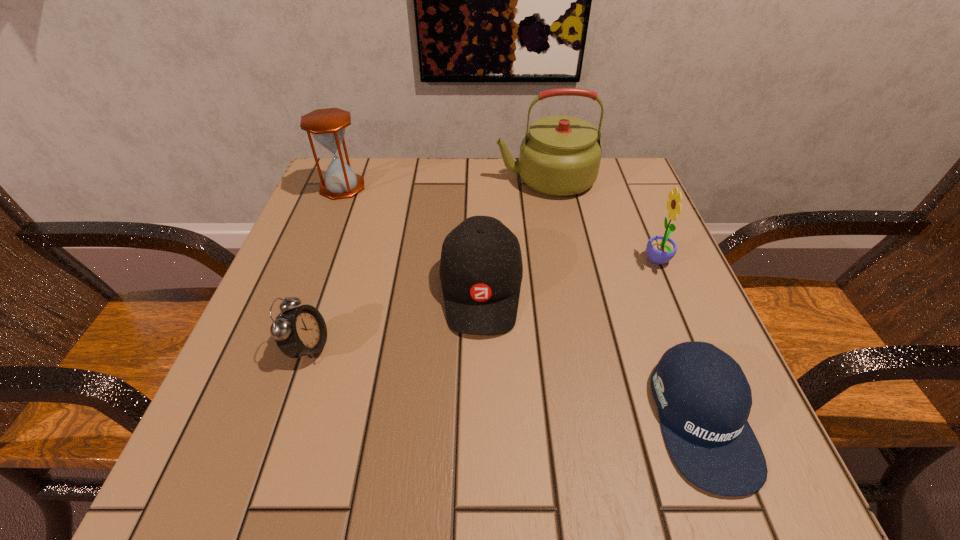
At what (x,y) coordinates should I click in order to perform the action: click on vacant space at the left edge of the desktop. Please return your answer as a coordinate pair (x, y). The width and height of the screenshot is (960, 540). Looking at the image, I should click on (342, 256).

Identify the location of vacant space at the far left corner of the desktop. (365, 214).

Locate an element on the screen. This screenshot has width=960, height=540. vacant region at the near left corner of the desktop is located at coordinates (253, 439).

In the image, there is a desktop. Identify the location of free space at the far right corner. (608, 183).

Where is `free space between the farther baseball cap and the hourglass`? The width and height of the screenshot is (960, 540). free space between the farther baseball cap and the hourglass is located at coordinates (412, 238).

The image size is (960, 540). In order to click on vacant space that's between the alarm clock and the kettle in this screenshot , I will do `click(426, 263)`.

You are a GUI agent. You are given a task and a screenshot of the screen. Output one action in this format:
    pyautogui.click(x=<x>, y=<y>)
    Task: Click on the free space between the sunflower and the kettle
    
    Given the screenshot: What is the action you would take?
    pyautogui.click(x=602, y=220)

Locate an element on the screen. The height and width of the screenshot is (540, 960). free space between the alarm clock and the kettle is located at coordinates (426, 263).

Find the location of `free point between the alarm clock and the hourglass`. free point between the alarm clock and the hourglass is located at coordinates (325, 267).

The height and width of the screenshot is (540, 960). I want to click on empty space that is in between the alarm clock and the left baseball cap, so click(x=395, y=318).